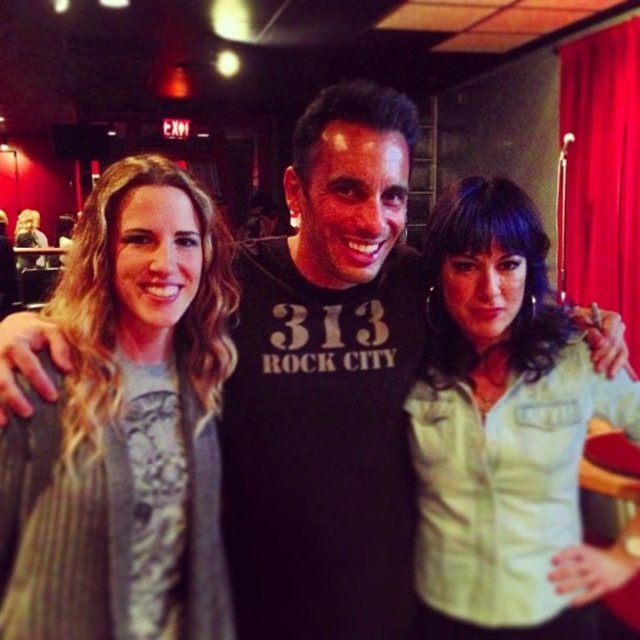
You are standing in a dimly lit room with three people. The person on the left is wearing a gray textured sweater. The person in the center is wearing a black Tshirt with white text. The person on the right is wearing a red jacket. How far apart are the gray textured sweater at left and the black Tshirt with white text in the center?

The gray textured sweater at left and the black Tshirt with white text in the center are 90.89 centimeters apart.

You are a photographer adjusting camera settings. You need to focus on the gray textured sweater at left and the blonde hair at center. Which object requires a closer focus due to its smaller size?

The gray textured sweater at left requires closer focus because it is thinner than the blonde hair at center, making it smaller in size.

Looking at this image, you are at a social event and want to take a photo of the group. To ensure both the gray textured sweater at left and the blonde hair at center are clearly visible, where should you position your camera relative to the group?

The gray textured sweater at left is below the blonde hair at center, so positioning the camera slightly above the group will ensure both elements are in frame and clearly visible.